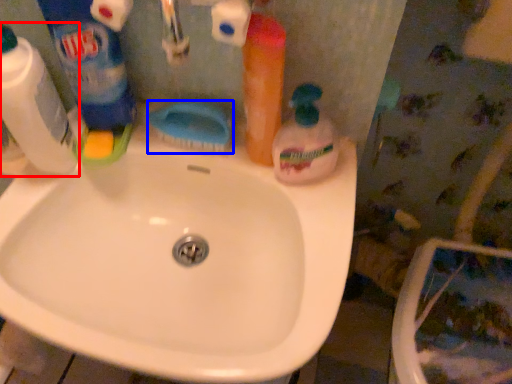
Question: Which point is closer to the camera, cleaning product (highlighted by a red box) or brush (highlighted by a blue box)?

Choices:
 (A) cleaning product
 (B) brush

Answer: (A)